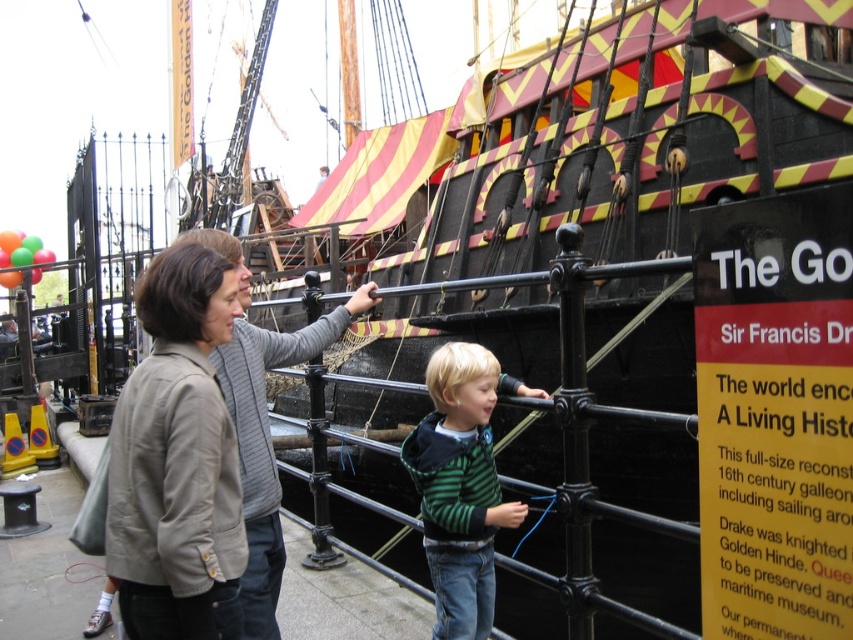
Who is taller, light brown fabric jacket at center or green striped sweater at center?

With more height is light brown fabric jacket at center.

Can you confirm if light brown fabric jacket at center is wider than green striped sweater at center?

Indeed, light brown fabric jacket at center has a greater width compared to green striped sweater at center.

Who is more forward, (212,330) or (477,531)?

Point (212,330) is in front.

Identify the location of light brown fabric jacket at center. (177, 460).